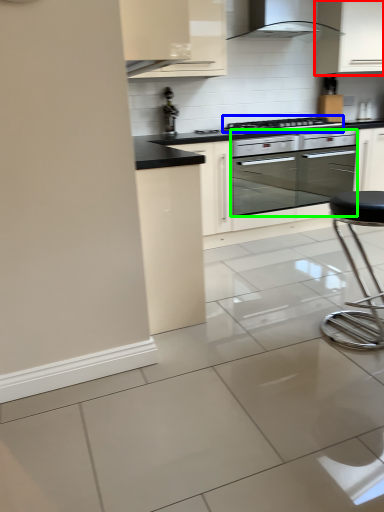
Question: Which object is the closest to the cabinetry (highlighted by a red box)? Choose among these: kitchen appliance (highlighted by a blue box) or oven (highlighted by a green box).

Choices:
 (A) kitchen appliance
 (B) oven

Answer: (A)